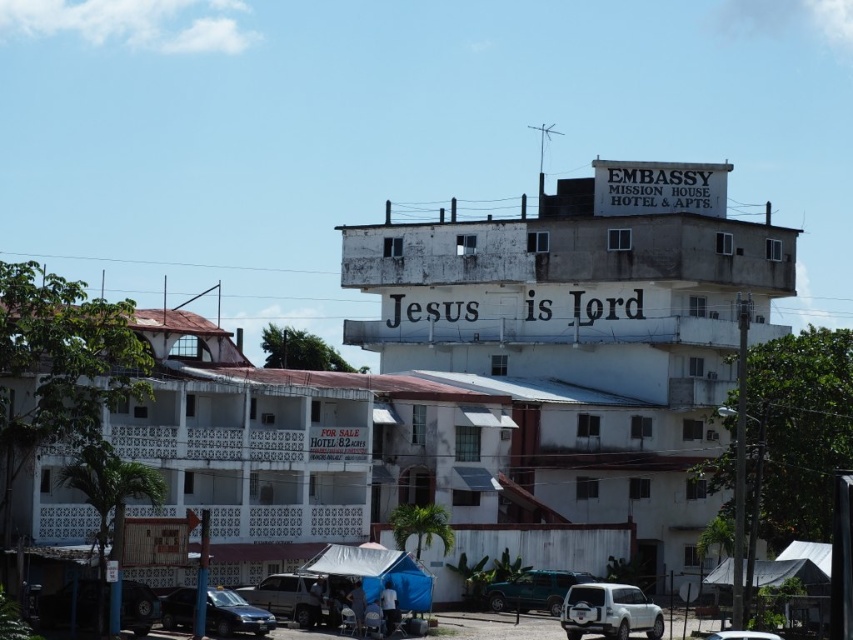
Is white matte suv at lower right positioned behind metallic blue sedan at lower left?

Yes, white matte suv at lower right is further from the viewer.

Can you confirm if white matte suv at lower right is bigger than metallic blue sedan at lower left?

Correct, white matte suv at lower right is larger in size than metallic blue sedan at lower left.

Locate an element on the screen. white matte suv at lower right is located at coordinates (608, 611).

The image size is (853, 640). In order to click on white matte suv at lower right in this screenshot , I will do `click(608, 611)`.

Where is `metallic silver car at lower left`? This screenshot has width=853, height=640. metallic silver car at lower left is located at coordinates (138, 608).

Is metallic silver car at lower left positioned at the back of teal matte car at lower center?

No, metallic silver car at lower left is in front of teal matte car at lower center.

Is point (49, 621) positioned in front of point (537, 579)?

Yes, it is.

This screenshot has height=640, width=853. I want to click on metallic silver car at lower left, so click(x=138, y=608).

Which is below, white matte suv at lower right or teal matte car at lower center?

teal matte car at lower center is lower down.

Which of these two, white matte suv at lower right or teal matte car at lower center, stands shorter?

teal matte car at lower center

Is point (567, 634) positioned behind point (549, 598)?

No, (567, 634) is closer to viewer.

I want to click on white matte suv at lower right, so click(x=608, y=611).